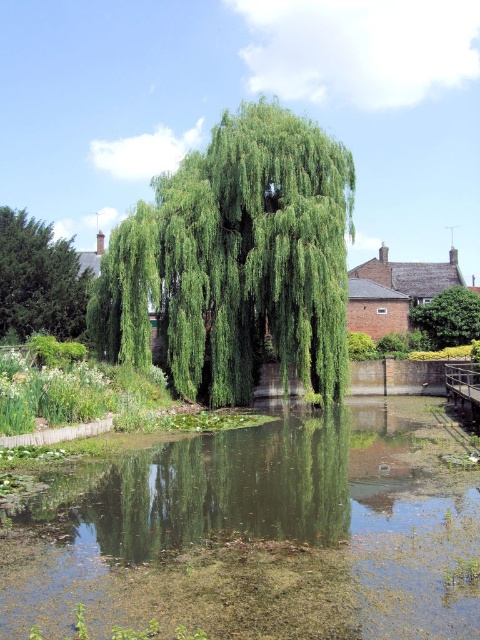
You are standing at the center of the image. Which direction should you move to get closer to the green leafy willow at center?

The green leafy willow at center is already at the center of the image, so you don not need to move in any direction to get closer.

You are a gardener standing at the edge of the garden to the left of the green leafy willow at center. You need to water the green leafy vegetation at center. If your watering can has a range of 40 feet, can you reach the vegetation without moving closer?

The distance between the green leafy vegetation at center and the green leafy willow at center is 44.11 feet. Since your watering can only reaches 40 feet, you cannot water the vegetation without moving closer.

You are standing at the edge of the pond and want to place a small decorative rock exactly at the center of the green leafy vegetation at center. According to the coordinates provided, where should you place the rock?

The green leafy vegetation at center is located at point (260, 532), so you should place the rock at those coordinates to position it exactly at the center of the green leafy vegetation at center.